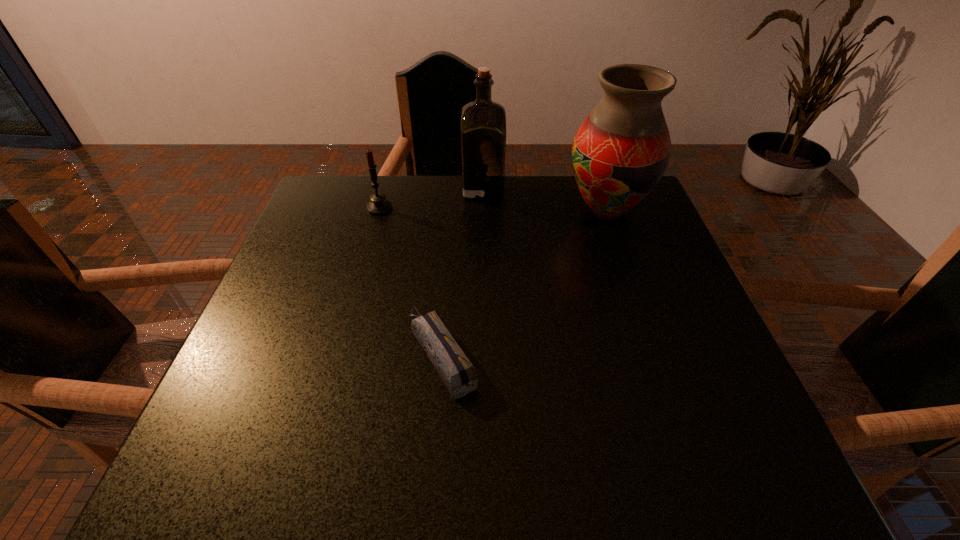
Find the location of `blank region between the candle and the liquor`. blank region between the candle and the liquor is located at coordinates (431, 198).

Where is `vacant area between the second shortest object and the pencil box`? The height and width of the screenshot is (540, 960). vacant area between the second shortest object and the pencil box is located at coordinates (411, 281).

What are the coordinates of `free area in between the vase and the liquor` in the screenshot? It's located at (544, 199).

Locate an element on the screen. This screenshot has height=540, width=960. free space between the second shortest object and the liquor is located at coordinates (431, 198).

In order to click on free spot between the liquor and the pencil box in this screenshot , I will do `click(463, 271)`.

I want to click on object that can be found as the third closest to the pencil box, so click(483, 122).

The width and height of the screenshot is (960, 540). I want to click on object that stands as the closest to the rightmost object, so click(x=483, y=122).

Where is `free location that satisfies the following two spatial constraints: 1. on the label of the vase; 2. on the left side of the liquor`? This screenshot has width=960, height=540. free location that satisfies the following two spatial constraints: 1. on the label of the vase; 2. on the left side of the liquor is located at coordinates (483, 211).

Image resolution: width=960 pixels, height=540 pixels. Find the location of `blank area in the image that satisfies the following two spatial constraints: 1. on the front side of the rightmost object; 2. on the left side of the candle`. blank area in the image that satisfies the following two spatial constraints: 1. on the front side of the rightmost object; 2. on the left side of the candle is located at coordinates pos(378,211).

The height and width of the screenshot is (540, 960). In order to click on vacant area in the image that satisfies the following two spatial constraints: 1. on the label of the liquor; 2. on the front side of the candle in this screenshot , I will do `click(483, 208)`.